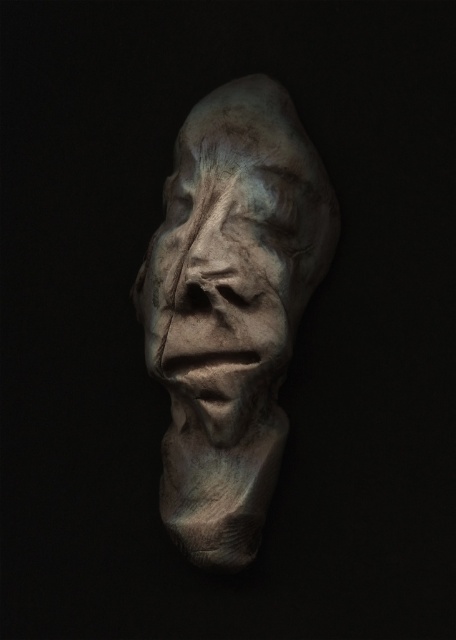
Measure the distance from matte stone sculpture at center to matte stone face at center.

matte stone sculpture at center is 0.67 inches from matte stone face at center.

Is matte stone sculpture at center positioned behind matte stone face at center?

Yes, matte stone sculpture at center is behind matte stone face at center.

The width and height of the screenshot is (456, 640). I want to click on matte stone sculpture at center, so click(231, 307).